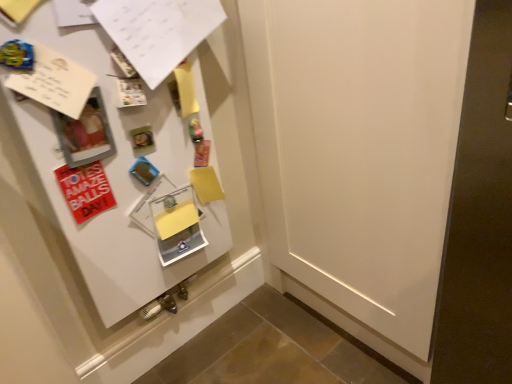
Question: Can you confirm if white paper at upper left is taller than red matte postcard at left?

Choices:
 (A) no
 (B) yes

Answer: (B)

Question: From the image's perspective, would you say white paper at upper left is shown under red matte postcard at left?

Choices:
 (A) yes
 (B) no

Answer: (B)

Question: Is white paper at upper left outside red matte postcard at left?

Choices:
 (A) yes
 (B) no

Answer: (A)

Question: From a real-world perspective, does white paper at upper left sit lower than red matte postcard at left?

Choices:
 (A) yes
 (B) no

Answer: (B)

Question: Is white paper at upper left further to camera compared to red matte postcard at left?

Choices:
 (A) yes
 (B) no

Answer: (B)

Question: Can you confirm if white paper at upper left is bigger than red matte postcard at left?

Choices:
 (A) no
 (B) yes

Answer: (B)

Question: Does red matte postcard at left have a greater width compared to white paper at upper left?

Choices:
 (A) yes
 (B) no

Answer: (B)

Question: Is red matte postcard at left oriented towards white paper at upper left?

Choices:
 (A) yes
 (B) no

Answer: (B)

Question: Is red matte postcard at left placed right next to white paper at upper left?

Choices:
 (A) no
 (B) yes

Answer: (A)

Question: Considering the relative sizes of red matte postcard at left and white paper at upper left in the image provided, is red matte postcard at left bigger than white paper at upper left?

Choices:
 (A) no
 (B) yes

Answer: (A)

Question: Is white paper at upper left located within red matte postcard at left?

Choices:
 (A) no
 (B) yes

Answer: (A)

Question: Is red matte postcard at left at the left side of white paper at upper left?

Choices:
 (A) no
 (B) yes

Answer: (B)

Question: Does point pyautogui.click(x=80, y=167) appear closer or farther from the camera than point pyautogui.click(x=136, y=56)?

Choices:
 (A) farther
 (B) closer

Answer: (A)